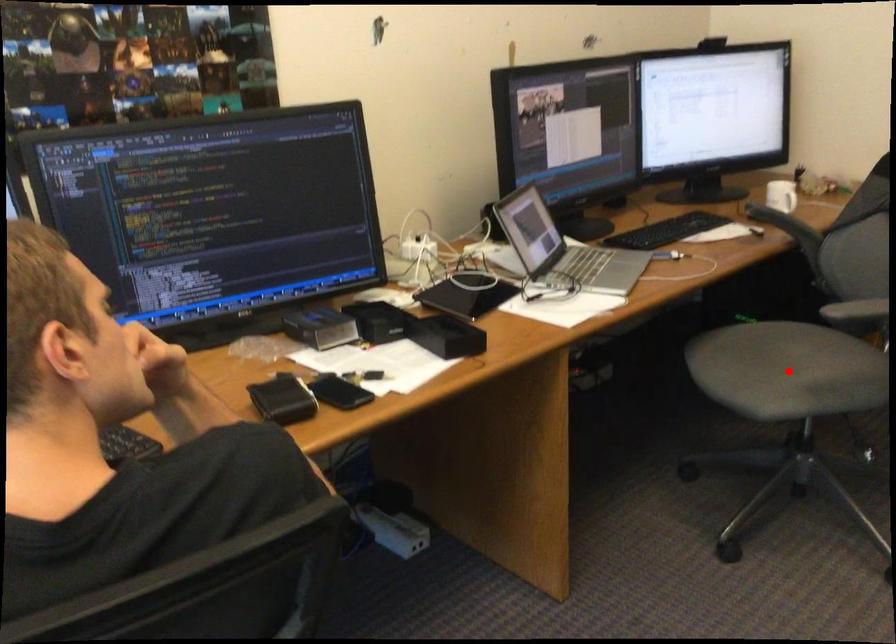
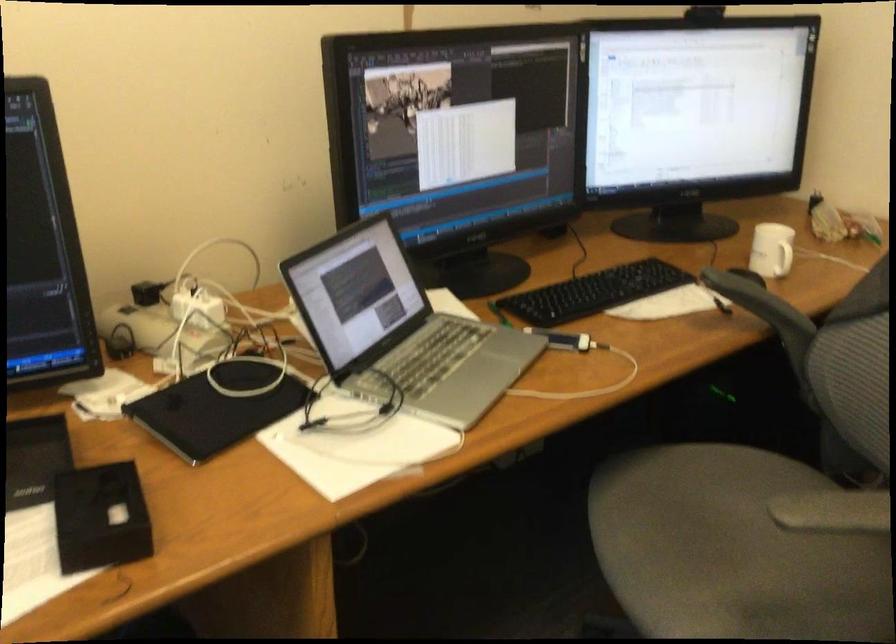
Question: I am providing you with two images of the same scene from different viewpoints. A red point is shown in image1. For the corresponding object point in image2, is it positioned nearer or farther from the camera?

Choices:
 (A) Nearer
 (B) Farther

Answer: (A)